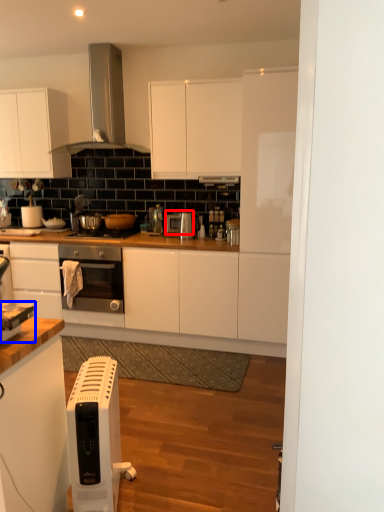
Question: Which point is closer to the camera, appliance (highlighted by a red box) or appliance (highlighted by a blue box)?

Choices:
 (A) appliance
 (B) appliance

Answer: (B)